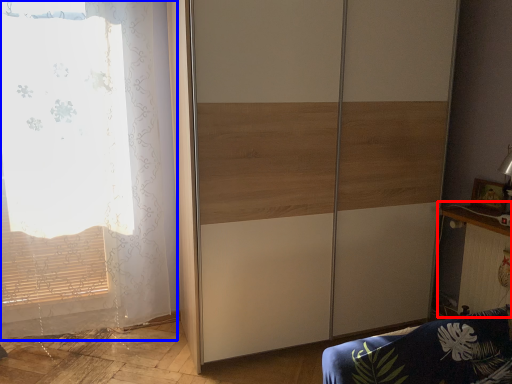
Question: Which of the following is the farthest to the observer, table (highlighted by a red box) or curtain (highlighted by a blue box)?

Choices:
 (A) table
 (B) curtain

Answer: (A)